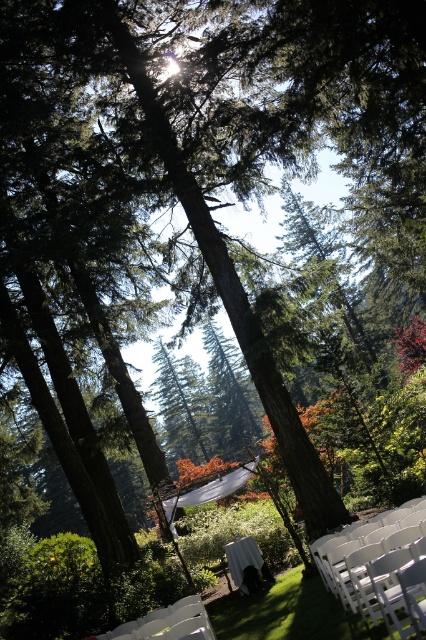
Who is positioned more to the right, white plastic chair at lower right or white plastic chair at lower center?

From the viewer's perspective, white plastic chair at lower right appears more on the right side.

Which is behind, point (374, 522) or point (203, 605)?

Positioned behind is point (374, 522).

Where is `white plastic chair at lower right`? white plastic chair at lower right is located at coordinates (359, 548).